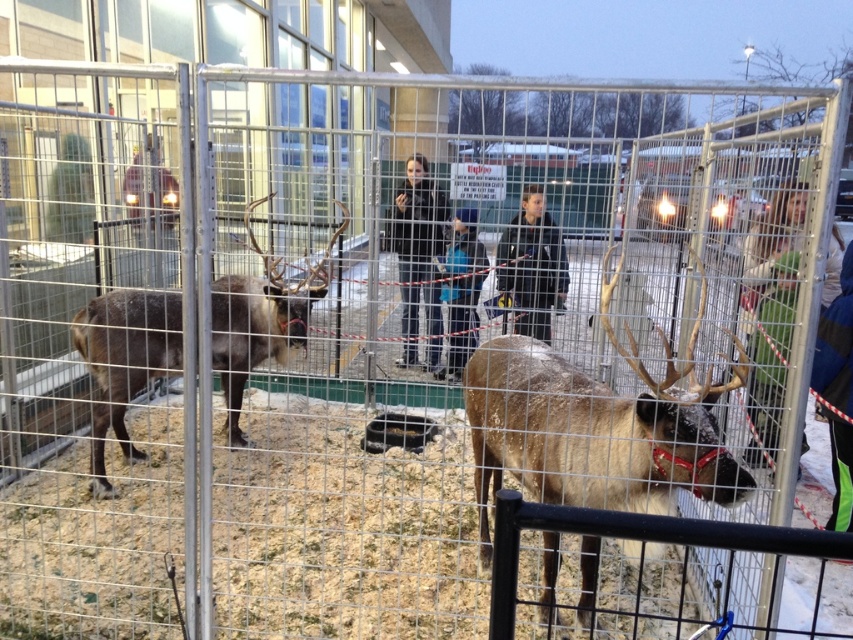
Does light brown fur at center appear on the right side of blue fabric jacket at center?

Yes, light brown fur at center is to the right of blue fabric jacket at center.

Does point (494, 481) lie behind point (457, 353)?

No, it is in front of (457, 353).

Is point (692, 342) positioned behind point (450, 259)?

No, it is in front of (450, 259).

Where is `light brown fur at center`? The width and height of the screenshot is (853, 640). light brown fur at center is located at coordinates (596, 426).

Can you confirm if green fabric coat at center is smaller than blue fabric jacket at center?

No, green fabric coat at center is not smaller than blue fabric jacket at center.

Which is behind, point (761, 275) or point (473, 211)?

Point (473, 211)

Where is `green fabric coat at center`? The width and height of the screenshot is (853, 640). green fabric coat at center is located at coordinates (775, 260).

Who is more distant from viewer, (531, 216) or (457, 208)?

Point (457, 208)

Describe the element at coordinates (532, 266) in the screenshot. I see `dark blue jacket at center` at that location.

Between point (502, 248) and point (476, 292), which one is positioned behind?

The point (476, 292) is more distant.

Locate an element on the screen. dark blue jacket at center is located at coordinates (532, 266).